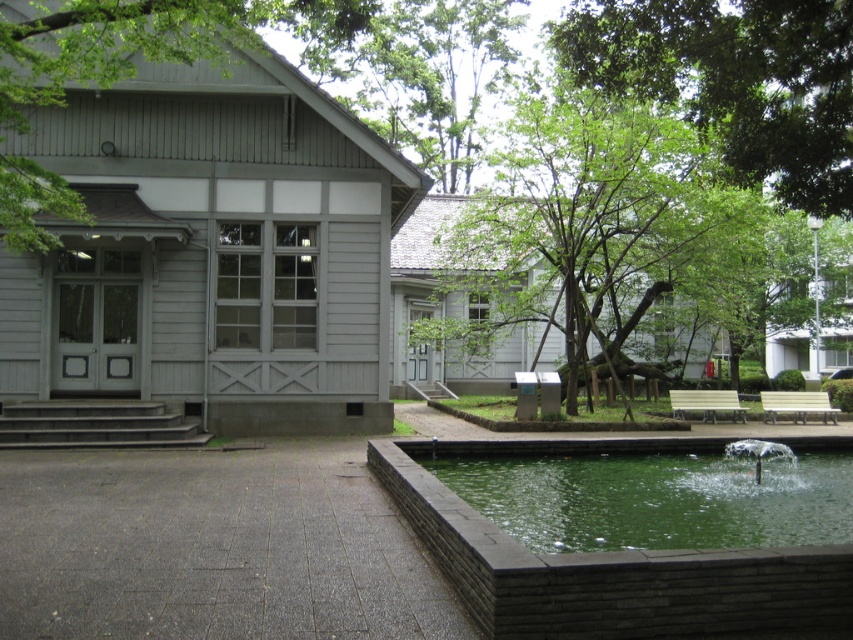
Does green leafy tree at center appear on the left side of green leafy tree at upper center?

No, green leafy tree at center is not to the left of green leafy tree at upper center.

Describe the element at coordinates (595, 234) in the screenshot. I see `green leafy tree at center` at that location.

Where is `green leafy tree at center`? The image size is (853, 640). green leafy tree at center is located at coordinates (595, 234).

Find the location of a particular element. green leafy tree at center is located at coordinates (595, 234).

Is green leafy tree at center further to camera compared to green stone water at lower right?

No, green leafy tree at center is closer to the viewer.

Based on the photo, who is more distant from viewer, (524, 134) or (828, 460)?

The point (524, 134) is behind.

Who is more forward, (723, 276) or (488, 477)?

Point (488, 477) is more forward.

Where is `green leafy tree at center`? green leafy tree at center is located at coordinates (595, 234).

Between green leafy tree at upper center and green wood tree at upper left, which one appears on the left side from the viewer's perspective?

Positioned to the left is green wood tree at upper left.

Is point (840, 120) in front of point (35, 180)?

Yes, it is.

Does point (799, 198) come farther from viewer compared to point (32, 81)?

No, (799, 198) is in front of (32, 81).

This screenshot has width=853, height=640. What are the coordinates of `green leafy tree at upper center` in the screenshot? It's located at (735, 81).